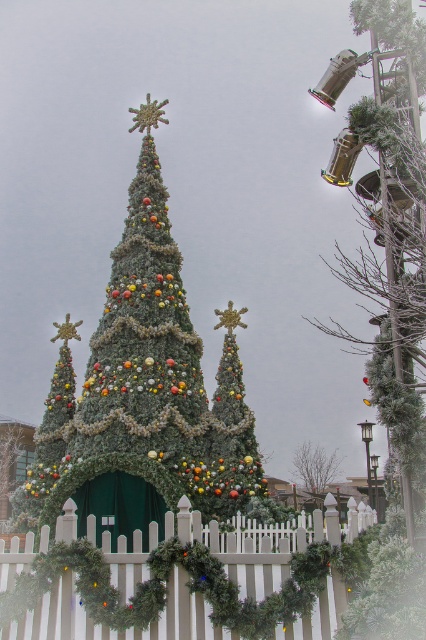
Who is positioned more to the right, frosted greenery at upper right or green matte christmas tree at center?

Positioned to the right is frosted greenery at upper right.

Is frosted greenery at upper right thinner than green matte christmas tree at center?

In fact, frosted greenery at upper right might be wider than green matte christmas tree at center.

Between point (411, 362) and point (334, 467), which one is positioned behind?

The point (334, 467) is more distant.

This screenshot has height=640, width=426. In order to click on frosted greenery at upper right in this screenshot , I will do `click(388, 296)`.

Is the position of white picket fence at center more distant than that of frosted greenery at upper right?

Yes, it is behind frosted greenery at upper right.

Does white picket fence at center have a greater width compared to frosted greenery at upper right?

Correct, the width of white picket fence at center exceeds that of frosted greenery at upper right.

Does point (120, 566) come in front of point (397, 344)?

Yes, it is in front of point (397, 344).

The height and width of the screenshot is (640, 426). Identify the location of white picket fence at center. (181, 579).

Can you confirm if green textured christmas tree at center is bigger than white picket fence at center?

Correct, green textured christmas tree at center is larger in size than white picket fence at center.

Is green textured christmas tree at center behind white picket fence at center?

Yes, green textured christmas tree at center is behind white picket fence at center.

You are a GUI agent. You are given a task and a screenshot of the screen. Output one action in this format:
    pyautogui.click(x=<x>, y=<y>)
    Task: Click on the green textured christmas tree at center
    This screenshot has width=426, height=640.
    Given the screenshot: What is the action you would take?
    pyautogui.click(x=146, y=392)

Where is `green textured christmas tree at center`? The image size is (426, 640). green textured christmas tree at center is located at coordinates (146, 392).